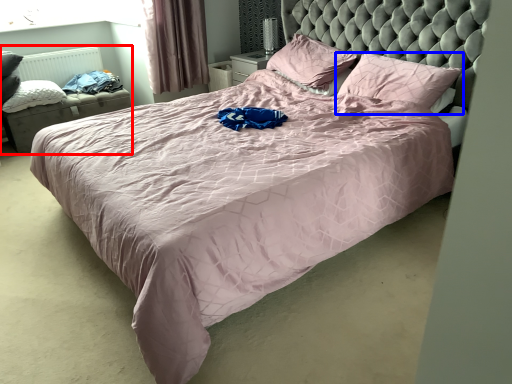
Question: Which of the following is the farthest to the observer, bed frame (highlighted by a red box) or pillow (highlighted by a blue box)?

Choices:
 (A) bed frame
 (B) pillow

Answer: (A)